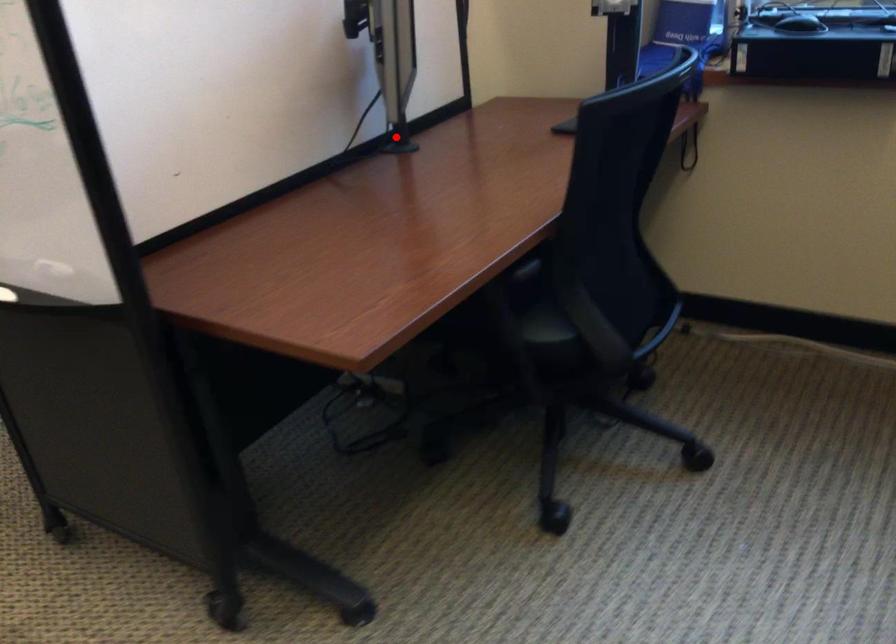
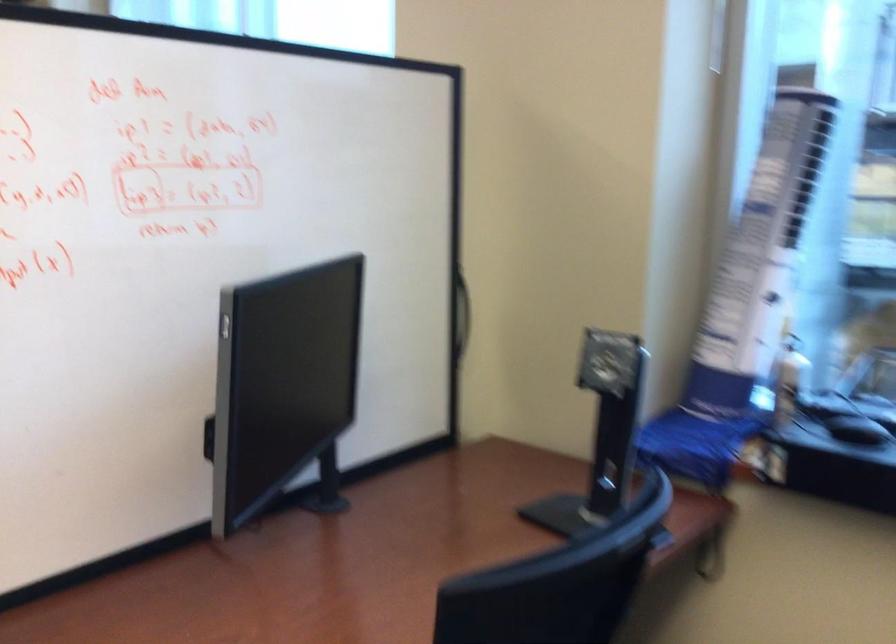
In the second image, find the point that corresponds to the highlighted location in the first image.

(325, 487)